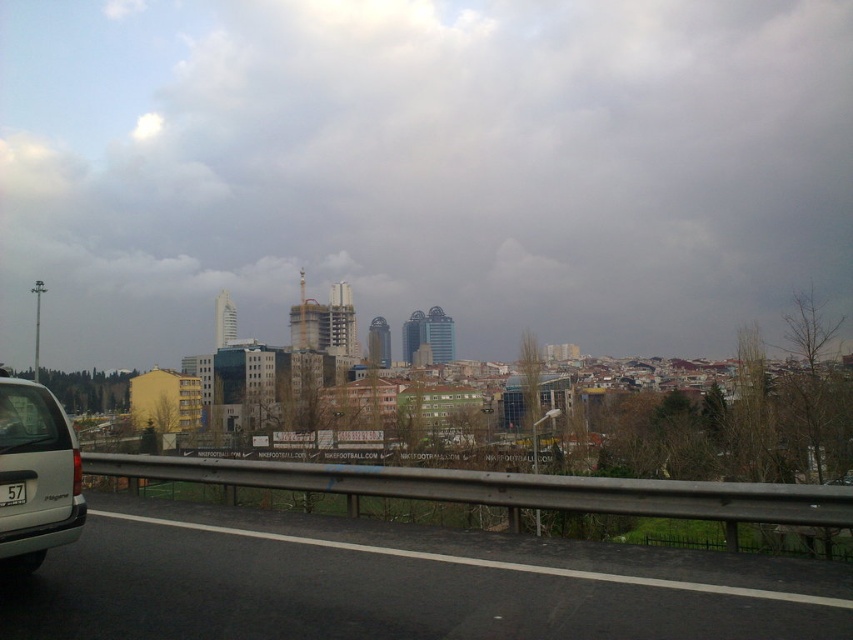
Question: Is black asphalt highway at lower left wider than silver metallic van at lower left?

Choices:
 (A) no
 (B) yes

Answer: (B)

Question: Which of the following is the farthest from the observer?

Choices:
 (A) silver metallic van at lower left
 (B) black plastic license plate at lower left

Answer: (B)

Question: Does silver metallic van at lower left come behind black plastic license plate at lower left?

Choices:
 (A) yes
 (B) no

Answer: (B)

Question: Which of the following is the closest to the observer?

Choices:
 (A) black plastic license plate at lower left
 (B) black asphalt highway at lower left

Answer: (B)

Question: Does black asphalt highway at lower left have a greater width compared to silver metallic van at lower left?

Choices:
 (A) yes
 (B) no

Answer: (A)

Question: Which point appears farthest from the camera in this image?

Choices:
 (A) (38, 513)
 (B) (486, 602)
 (C) (22, 497)

Answer: (A)